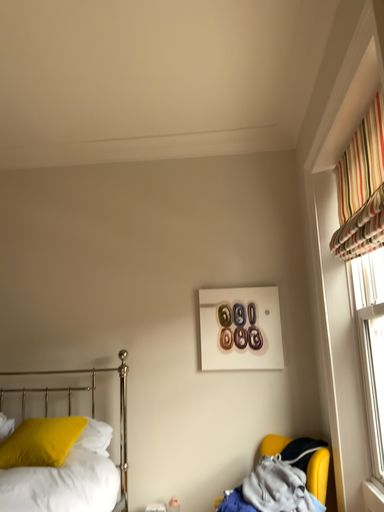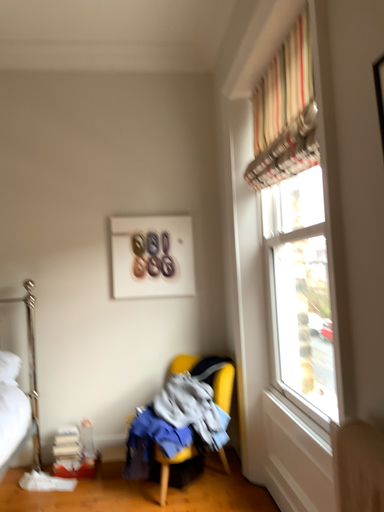
Question: Which way did the camera rotate in the video?

Choices:
 (A) rotated upward
 (B) rotated downward

Answer: (B)